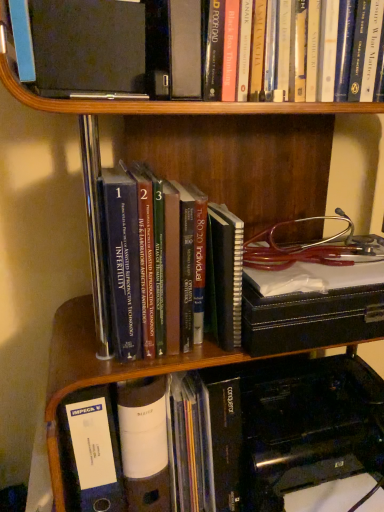
Question: Is hardcover book at upper center, acting as the 1th book starting from the top, looking in the opposite direction of orange matte book at center, which is the third book in top-to-bottom order?

Choices:
 (A) no
 (B) yes

Answer: (A)

Question: Would you consider hardcover book at upper center, acting as the 1th book starting from the top, to be distant from orange matte book at center, which is counted as the first book, starting from the bottom?

Choices:
 (A) yes
 (B) no

Answer: (B)

Question: Is hardcover book at upper center, which is the 3th book in bottom-to-top order, closer to camera compared to orange matte book at center, which is counted as the first book, starting from the bottom?

Choices:
 (A) no
 (B) yes

Answer: (B)

Question: Considering the relative sizes of hardcover book at upper center, which is the 3th book in bottom-to-top order, and orange matte book at center, which is counted as the first book, starting from the bottom, in the image provided, is hardcover book at upper center, which is the 3th book in bottom-to-top order, shorter than orange matte book at center, which is counted as the first book, starting from the bottom,?

Choices:
 (A) yes
 (B) no

Answer: (B)

Question: Is hardcover book at upper center, acting as the 1th book starting from the top, at the left side of orange matte book at center, which is the third book in top-to-bottom order?

Choices:
 (A) yes
 (B) no

Answer: (A)

Question: In the image, is orange matte book at center, which is counted as the first book, starting from the bottom, positioned in front of or behind blue hardcover books at center, the 2th book positioned from the bottom?

Choices:
 (A) behind
 (B) front

Answer: (A)

Question: Looking at the image, does orange matte book at center, which is counted as the first book, starting from the bottom, seem bigger or smaller compared to blue hardcover books at center, the second book when ordered from top to bottom?

Choices:
 (A) big
 (B) small

Answer: (B)

Question: From their relative heights in the image, would you say orange matte book at center, which is the third book in top-to-bottom order, is taller or shorter than blue hardcover books at center, the second book when ordered from top to bottom?

Choices:
 (A) tall
 (B) short

Answer: (B)

Question: From the image's perspective, relative to blue hardcover books at center, the second book when ordered from top to bottom, is orange matte book at center, which is counted as the first book, starting from the bottom, above or below?

Choices:
 (A) below
 (B) above

Answer: (A)

Question: From the image's perspective, is blue hardcover books at center, the second book when ordered from top to bottom, located above or below hardcover book at upper center, acting as the 1th book starting from the top?

Choices:
 (A) above
 (B) below

Answer: (B)

Question: Considering the relative positions of blue hardcover books at center, the 2th book positioned from the bottom, and hardcover book at upper center, which is the 3th book in bottom-to-top order, in the image provided, is blue hardcover books at center, the 2th book positioned from the bottom, to the left or to the right of hardcover book at upper center, which is the 3th book in bottom-to-top order,?

Choices:
 (A) right
 (B) left

Answer: (B)

Question: Considering their positions, is blue hardcover books at center, the second book when ordered from top to bottom, located in front of or behind hardcover book at upper center, acting as the 1th book starting from the top?

Choices:
 (A) behind
 (B) front

Answer: (A)

Question: Considering the positions of blue hardcover books at center, the 2th book positioned from the bottom, and hardcover book at upper center, acting as the 1th book starting from the top, in the image, is blue hardcover books at center, the 2th book positioned from the bottom, wider or thinner than hardcover book at upper center, acting as the 1th book starting from the top,?

Choices:
 (A) thin
 (B) wide

Answer: (B)

Question: In terms of height, does orange matte book at center, which is counted as the first book, starting from the bottom, look taller or shorter compared to hardcover book at upper center, acting as the 1th book starting from the top?

Choices:
 (A) tall
 (B) short

Answer: (B)

Question: Is orange matte book at center, which is the third book in top-to-bottom order, to the left or to the right of hardcover book at upper center, acting as the 1th book starting from the top, in the image?

Choices:
 (A) left
 (B) right

Answer: (B)